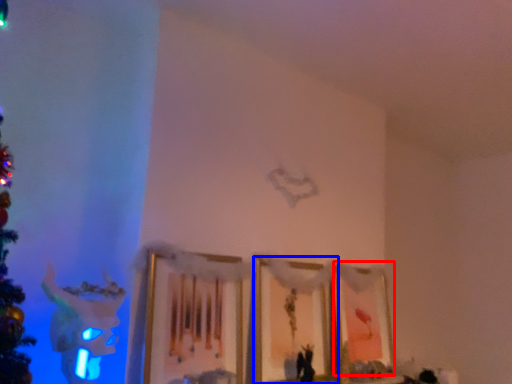
Question: Which of the following is the farthest to the observer, picture frame (highlighted by a red box) or picture frame (highlighted by a blue box)?

Choices:
 (A) picture frame
 (B) picture frame

Answer: (A)